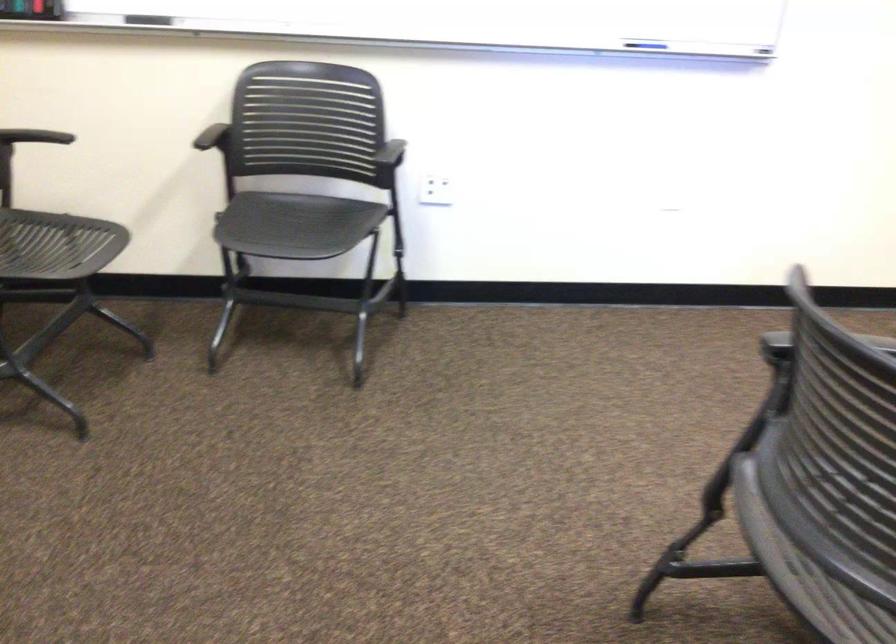
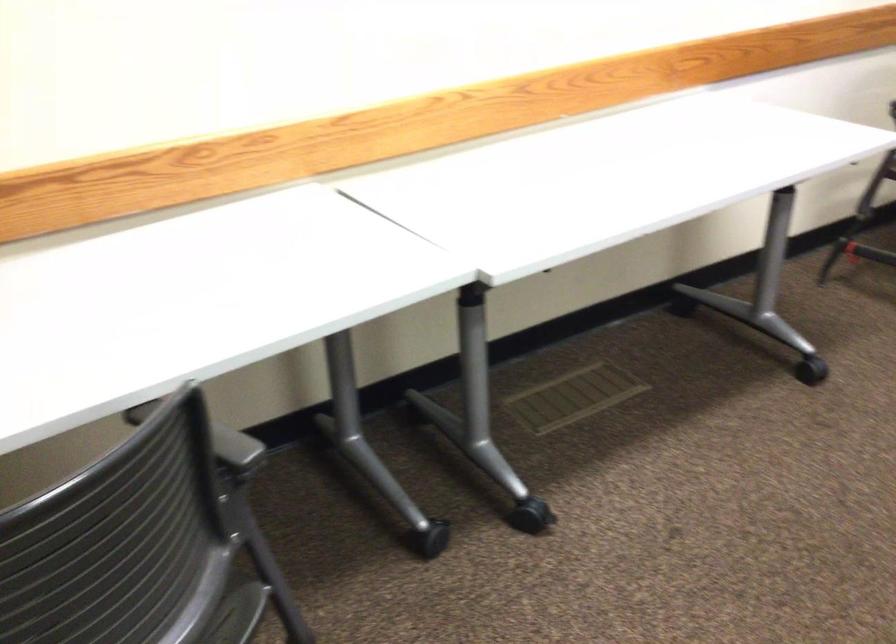
Question: Based on the continuous images, in which direction is the camera rotating? Reply with the corresponding letter.

Choices:
 (A) Left
 (B) Right
 (C) Up
 (D) Down

Answer: (A)